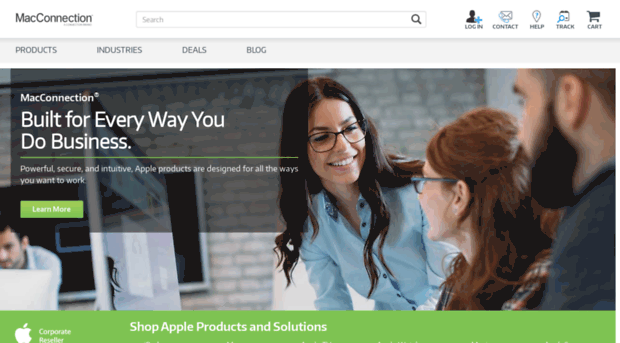
Find the location of a particular element. computer is located at coordinates (32, 291).